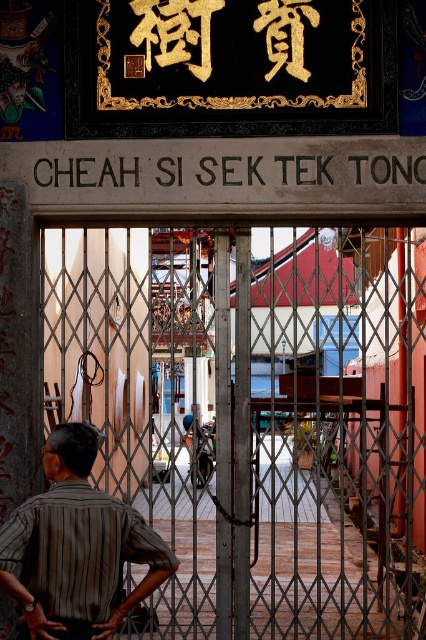
Which of these two, brown striped shirt at center or black stone sign at center, stands taller?

Standing taller between the two is brown striped shirt at center.

Describe the element at coordinates (77, 547) in the screenshot. I see `brown striped shirt at center` at that location.

Find the location of `brown striped shirt at center`. brown striped shirt at center is located at coordinates (77, 547).

From the picture: Does metallic gate at center appear on the left side of black stone sign at center?

In fact, metallic gate at center is to the right of black stone sign at center.

The image size is (426, 640). Find the location of `metallic gate at center`. metallic gate at center is located at coordinates (253, 419).

Does metallic gate at center appear on the right side of brown striped shirt at center?

Indeed, metallic gate at center is positioned on the right side of brown striped shirt at center.

What are the coordinates of `metallic gate at center` in the screenshot? It's located at (x=253, y=419).

At what (x,y) coordinates should I click in order to perform the action: click on metallic gate at center. Please return your answer as a coordinate pair (x, y). This screenshot has height=640, width=426. Looking at the image, I should click on (253, 419).